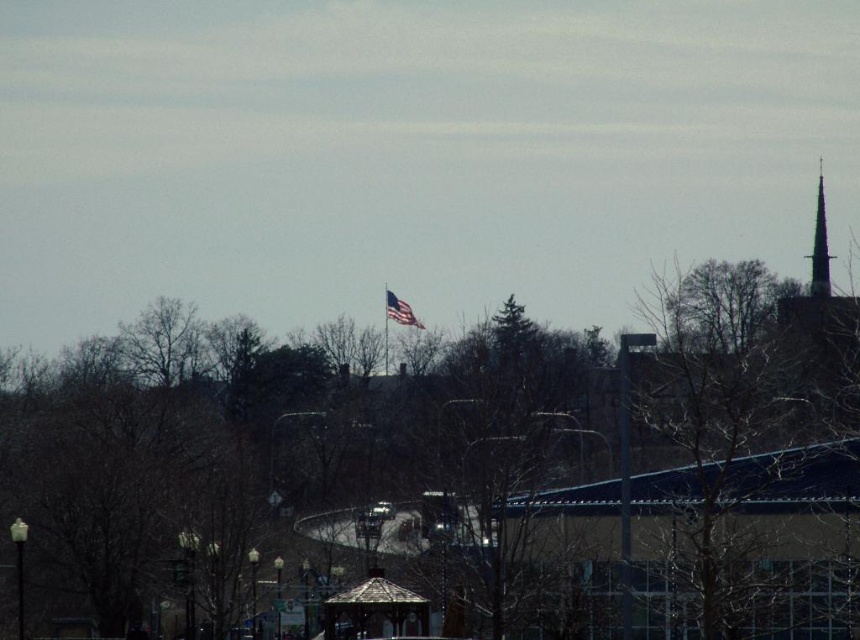
Who is positioned more to the right, bare branches at right or smooth gray spire at upper right?

smooth gray spire at upper right

Identify the location of bare branches at right. click(x=703, y=403).

Does bare branches at right have a greater width compared to american flag at center?

Correct, the width of bare branches at right exceeds that of american flag at center.

Is bare branches at right taller than american flag at center?

Yes.

Is point (690, 353) closer to camera compared to point (404, 301)?

Yes, it is in front of point (404, 301).

The width and height of the screenshot is (860, 640). In order to click on bare branches at right in this screenshot , I will do `click(703, 403)`.

Is bare branches at right taller than wooden gazebo at center?

Yes.

The width and height of the screenshot is (860, 640). I want to click on bare branches at right, so click(x=703, y=403).

You are a GUI agent. You are given a task and a screenshot of the screen. Output one action in this format:
    pyautogui.click(x=<x>, y=<y>)
    Task: Click on the bare branches at right
    
    Given the screenshot: What is the action you would take?
    pyautogui.click(x=703, y=403)